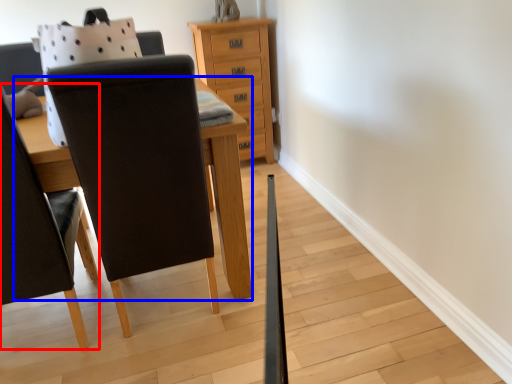
Question: Which object is further to the camera taking this photo, chair (highlighted by a red box) or table (highlighted by a blue box)?

Choices:
 (A) chair
 (B) table

Answer: (B)